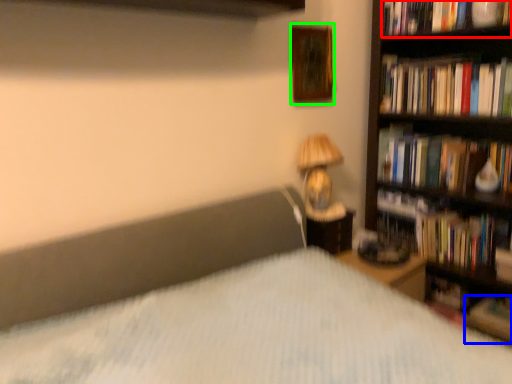
Question: Which object is positioned closest to book (highlighted by a red box)? Select from book (highlighted by a blue box) and picture frame (highlighted by a green box).

Choices:
 (A) book
 (B) picture frame

Answer: (B)